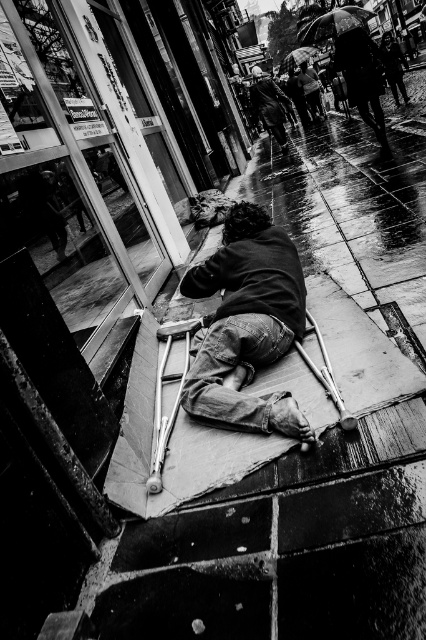
Looking at this image, is dark fabric umbrella at upper right thinner than ragged clothing at center?

Yes, dark fabric umbrella at upper right is thinner than ragged clothing at center.

Between dark fabric umbrella at upper right and ragged clothing at center, which one is positioned higher?

ragged clothing at center is higher up.

Who is more distant from viewer, (348, 72) or (278, 106)?

The point (278, 106) is more distant.

Image resolution: width=426 pixels, height=640 pixels. What are the coordinates of `dark fabric umbrella at upper right` in the screenshot? It's located at (362, 77).

Can you confirm if denim jeans at lower center is taller than black matte umbrella at upper center?

No, denim jeans at lower center is not taller than black matte umbrella at upper center.

Is point (229, 285) in front of point (313, 10)?

Yes, point (229, 285) is closer to viewer.

Image resolution: width=426 pixels, height=640 pixels. Identify the location of denim jeans at lower center. (247, 324).

What do you see at coordinates (247, 324) in the screenshot? I see `denim jeans at lower center` at bounding box center [247, 324].

Measure the distance between denim jeans at lower center and ragged clothing at center.

They are 11.02 meters apart.

At what (x,y) coordinates should I click in order to perform the action: click on denim jeans at lower center. Please return your answer as a coordinate pair (x, y). This screenshot has width=426, height=640. Looking at the image, I should click on (247, 324).

The height and width of the screenshot is (640, 426). Find the location of `denim jeans at lower center`. denim jeans at lower center is located at coordinates (247, 324).